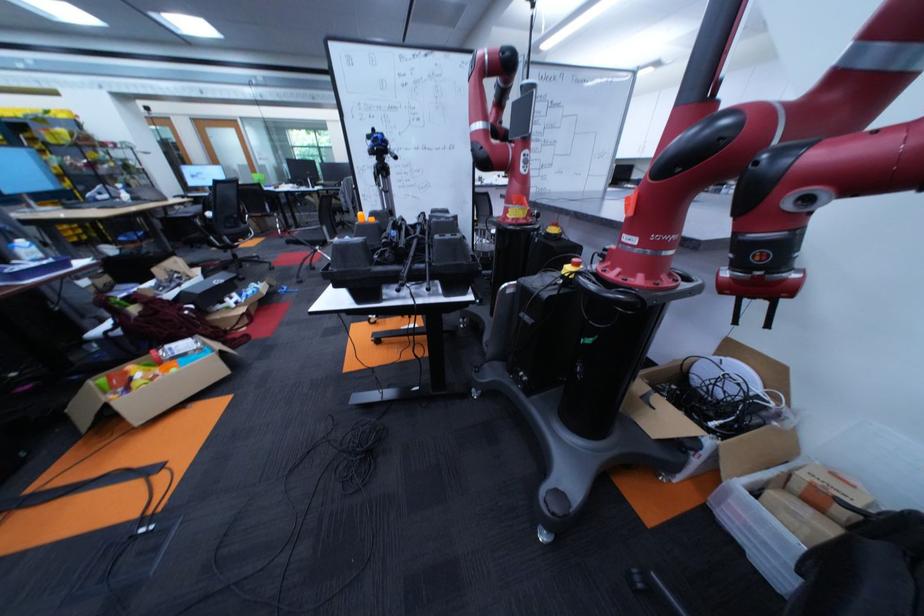
Find where to lift the plastic water bottle. Please return your answer as a coordinate pair (x, y).

(26, 249)